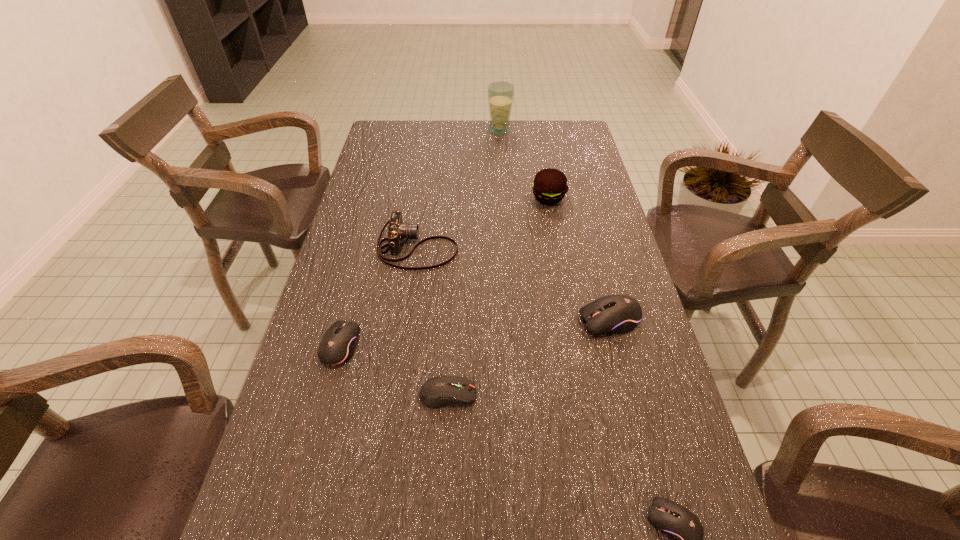
Image resolution: width=960 pixels, height=540 pixels. In order to click on patty present at the right edge in this screenshot , I will do `click(549, 186)`.

You are a GUI agent. You are given a task and a screenshot of the screen. Output one action in this format:
    pyautogui.click(x=<x>, y=<y>)
    Task: Click on the computer mouse at the right edge
    The image size is (960, 540).
    Given the screenshot: What is the action you would take?
    pyautogui.click(x=614, y=313)

In the image, there is a desktop. What are the coordinates of `free space at the far edge` in the screenshot? It's located at (492, 137).

The width and height of the screenshot is (960, 540). In the image, there is a desktop. Find the location of `vacant space at the left edge`. vacant space at the left edge is located at coordinates (360, 265).

I want to click on free region at the right edge of the desktop, so click(x=577, y=202).

In the image, there is a desktop. What are the coordinates of `vacant area at the far left corner` in the screenshot? It's located at tap(380, 134).

In order to click on vacant region at the far right corner in this screenshot , I will do `click(575, 132)`.

At what (x,y) coordinates should I click in order to perform the action: click on free space between the tallest computer mouse and the camera. Please return your answer as a coordinate pair (x, y). The height and width of the screenshot is (540, 960). Looking at the image, I should click on (514, 284).

Find the location of a particular element. The height and width of the screenshot is (540, 960). vacant space in between the second farthest object and the dark computer equipment is located at coordinates (498, 296).

Image resolution: width=960 pixels, height=540 pixels. In order to click on free space between the sixth shortest object and the fourth object from right to left in this screenshot , I will do `click(524, 164)`.